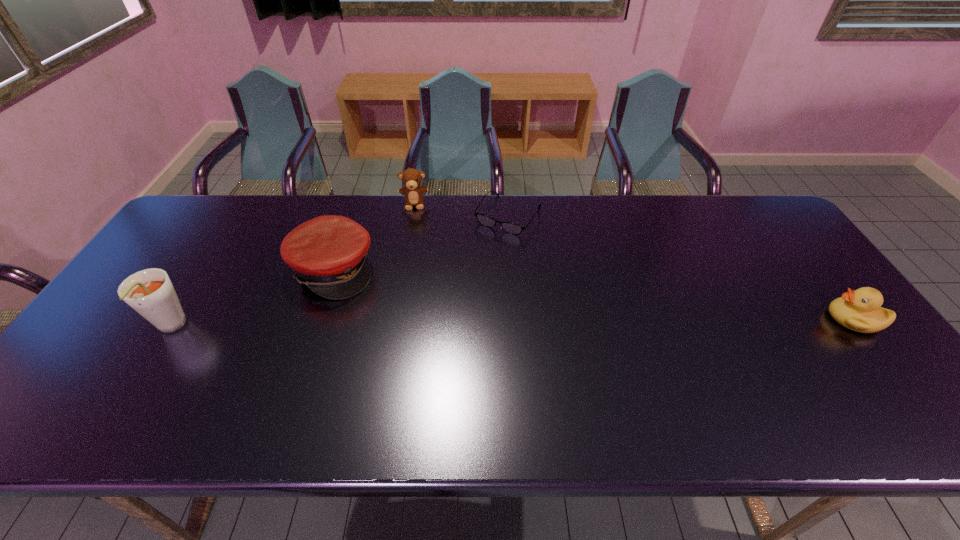
Where is `spectacles that is at the far edge`? The height and width of the screenshot is (540, 960). spectacles that is at the far edge is located at coordinates (512, 228).

Locate an element on the screen. teddy bear that is at the far edge is located at coordinates (411, 178).

This screenshot has width=960, height=540. I want to click on object that is positioned at the left edge, so (149, 292).

Where is `object at the right edge`? The width and height of the screenshot is (960, 540). object at the right edge is located at coordinates (859, 310).

The width and height of the screenshot is (960, 540). I want to click on vacant space at the far edge of the desktop, so click(335, 207).

Locate an element on the screen. The height and width of the screenshot is (540, 960). free space at the near edge of the desktop is located at coordinates (217, 394).

In the image, there is a desktop. Where is `vacant region at the left edge`? The image size is (960, 540). vacant region at the left edge is located at coordinates click(127, 319).

Image resolution: width=960 pixels, height=540 pixels. What are the coordinates of `free space at the right edge of the desktop` in the screenshot? It's located at (800, 310).

In the image, there is a desktop. Where is `vacant space at the far right corner`? Image resolution: width=960 pixels, height=540 pixels. vacant space at the far right corner is located at coordinates (735, 208).

Locate an element on the screen. The width and height of the screenshot is (960, 540). free point between the rightmost object and the teddy bear is located at coordinates [x=635, y=261].